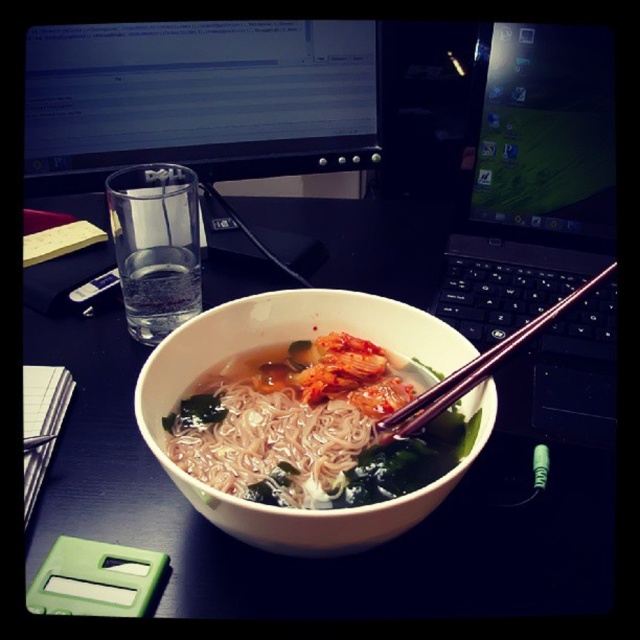
Question: Which point appears closest to the camera in this image?

Choices:
 (A) (605, 51)
 (B) (61, 67)
 (C) (56, 320)

Answer: (A)

Question: Among these objects, which one is nearest to the camera?

Choices:
 (A) white glossy bowl at center
 (B) white matte bowl at center
 (C) matte black monitor at upper center

Answer: (B)

Question: Is white glossy bowl at center below black plastic laptop at center?

Choices:
 (A) yes
 (B) no

Answer: (A)

Question: In this image, where is white matte bowl at center located relative to white matte noodles at center?

Choices:
 (A) above
 (B) below

Answer: (A)

Question: Is matte black monitor at upper center smaller than metallic brown chopsticks at center?

Choices:
 (A) no
 (B) yes

Answer: (A)

Question: Among these objects, which one is farthest from the camera?

Choices:
 (A) matte black monitor at upper center
 (B) white glossy bowl at center
 (C) metallic brown chopsticks at center
 (D) white matte noodles at center

Answer: (A)